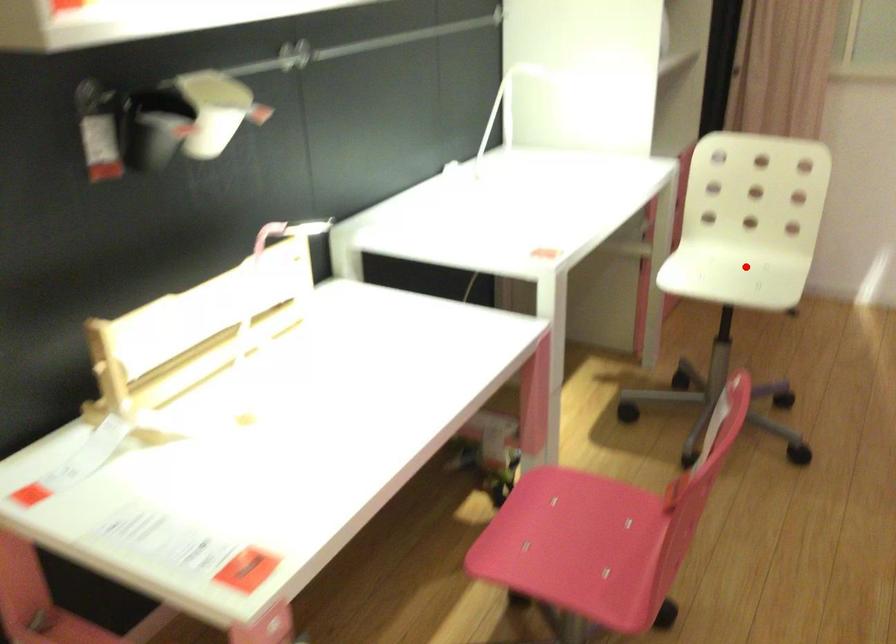
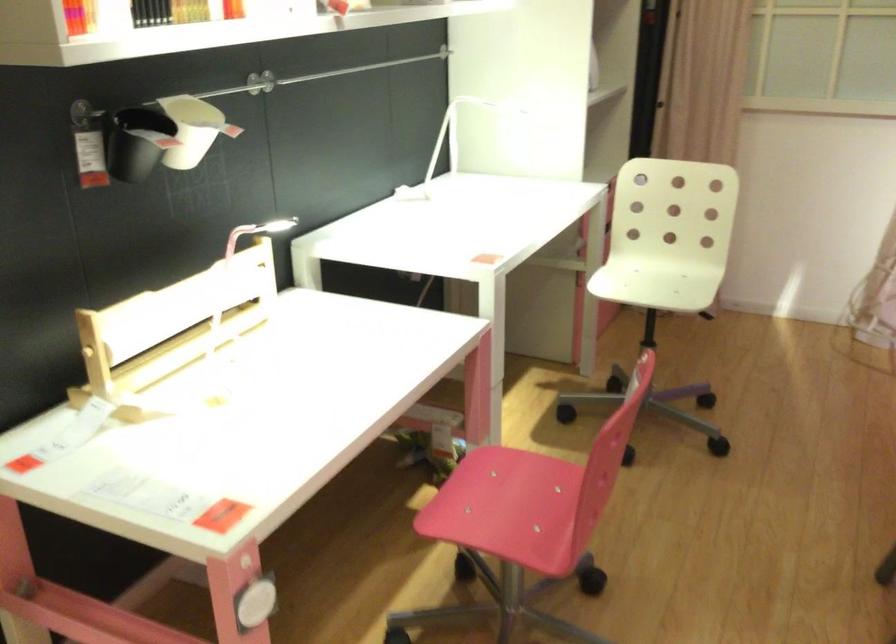
In the second image, find the point that corresponds to the highlighted location in the first image.

(668, 277)